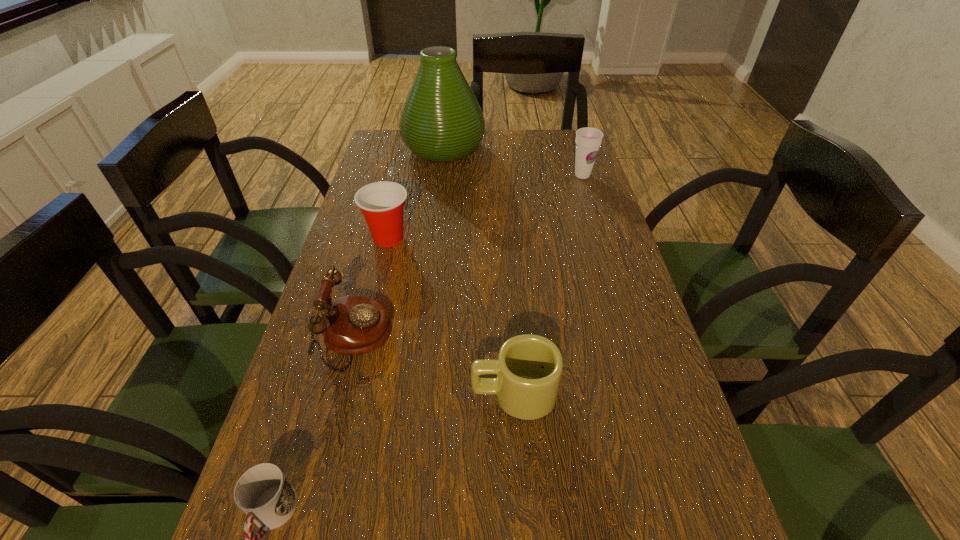
Identify the location of vacant region at the left edge of the desktop. Image resolution: width=960 pixels, height=540 pixels. (366, 231).

Where is `vacant region at the right edge of the desktop`? This screenshot has width=960, height=540. vacant region at the right edge of the desktop is located at coordinates (557, 195).

Locate an element on the screen. blank region between the fourth nearest object and the tallest object is located at coordinates (416, 193).

The height and width of the screenshot is (540, 960). I want to click on free point between the farthest cup and the second farthest cup, so pyautogui.click(x=486, y=206).

This screenshot has width=960, height=540. Identify the location of free space between the tallest object and the second farthest cup. (416, 193).

Identify the location of vacant space that is in between the second farthest cup and the vase. This screenshot has height=540, width=960. (416, 193).

Image resolution: width=960 pixels, height=540 pixels. I want to click on vacant area that lies between the mug and the rightmost object, so click(x=548, y=285).

Locate an element on the screen. Image resolution: width=960 pixels, height=540 pixels. free space between the telephone and the second farthest cup is located at coordinates (372, 287).

In order to click on vacant area that lies between the fourth nearest object and the mug in this screenshot , I will do `click(451, 316)`.

The width and height of the screenshot is (960, 540). I want to click on free spot between the telephone and the mug, so click(435, 366).